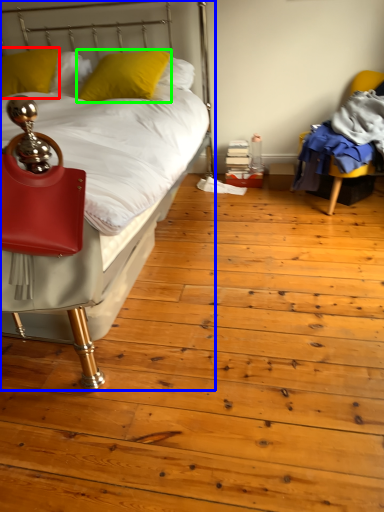
Question: Which object is positioned closest to pillow (highlighted by a red box)? Select from bed (highlighted by a blue box) and pillow (highlighted by a green box).

Choices:
 (A) bed
 (B) pillow

Answer: (B)